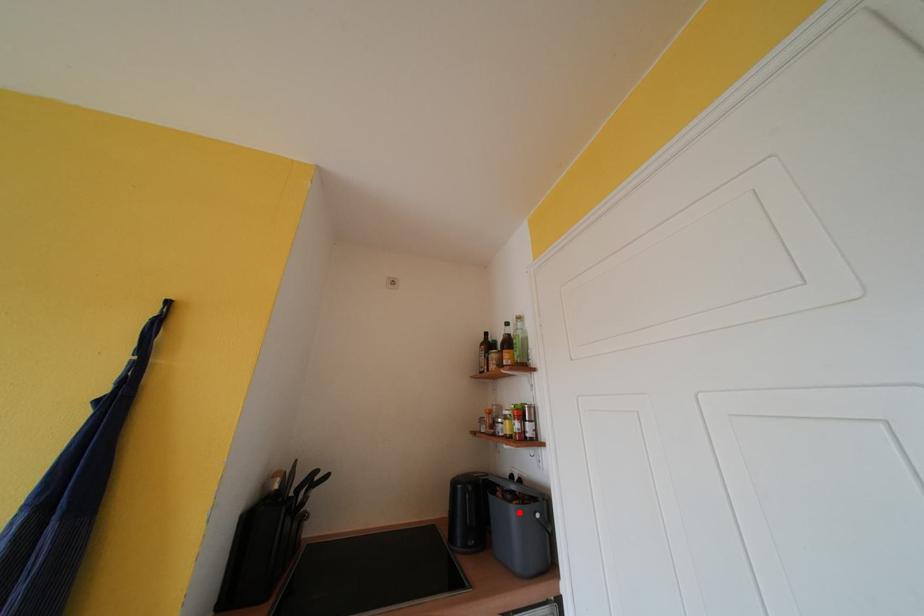
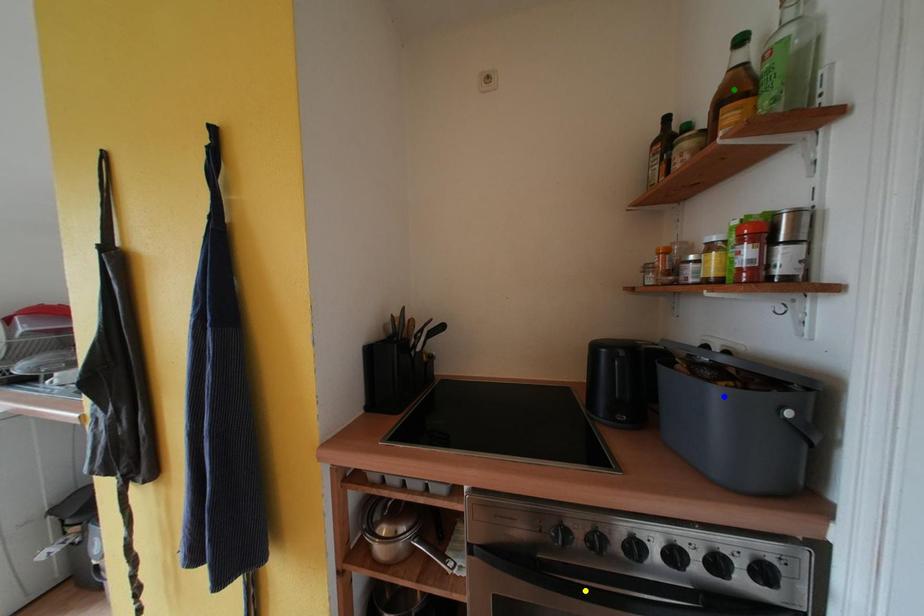
Question: I am providing you with two images of the same scene from different viewpoints. A red point is marked on the first image. You are given multiple points on the second image. Which mark in image 2 goes with the point in image 1?

Choices:
 (A) blue point
 (B) yellow point
 (C) green point

Answer: (A)